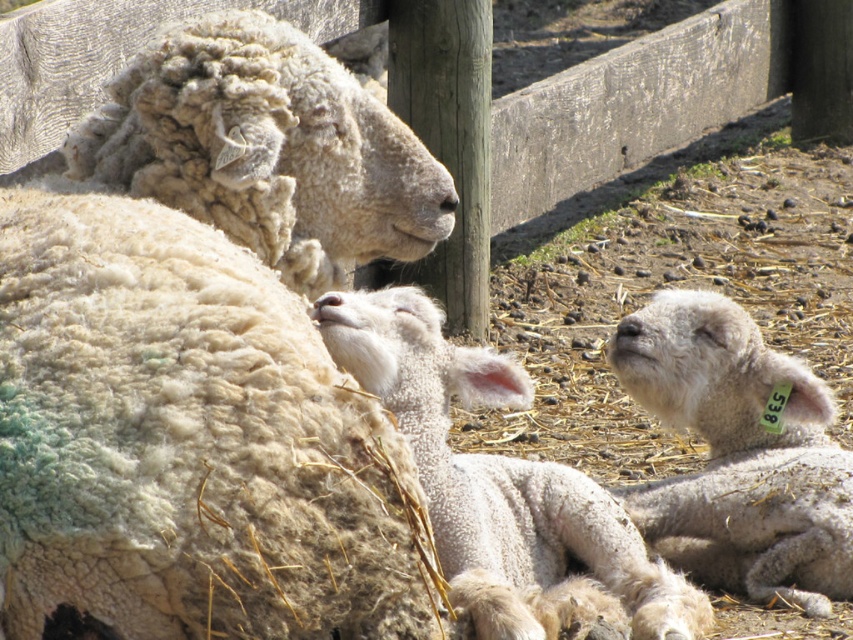
Question: Is white woolen sheep at upper left positioned at the back of white fluffy lamb at center?

Choices:
 (A) yes
 (B) no

Answer: (B)

Question: Which is nearer to the white fluffy lamb at center?

Choices:
 (A) white woolen sheep at upper left
 (B) white fluffy lamb at right

Answer: (A)

Question: Is white woolen sheep at upper left above white fluffy lamb at right?

Choices:
 (A) yes
 (B) no

Answer: (A)

Question: Among these points, which one is farthest from the camera?

Choices:
 (A) (817, 547)
 (B) (418, 291)
 (C) (91, 196)

Answer: (B)

Question: Does white fluffy lamb at center appear on the right side of white fluffy lamb at right?

Choices:
 (A) no
 (B) yes

Answer: (A)

Question: Which object is positioned closest to the white fluffy lamb at center?

Choices:
 (A) white fluffy lamb at right
 (B) white woolen sheep at upper left

Answer: (B)